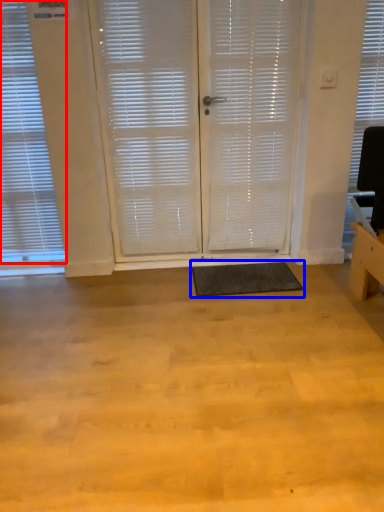
Question: Which object is further to the camera taking this photo, window blind (highlighted by a red box) or yoga mat (highlighted by a blue box)?

Choices:
 (A) window blind
 (B) yoga mat

Answer: (B)